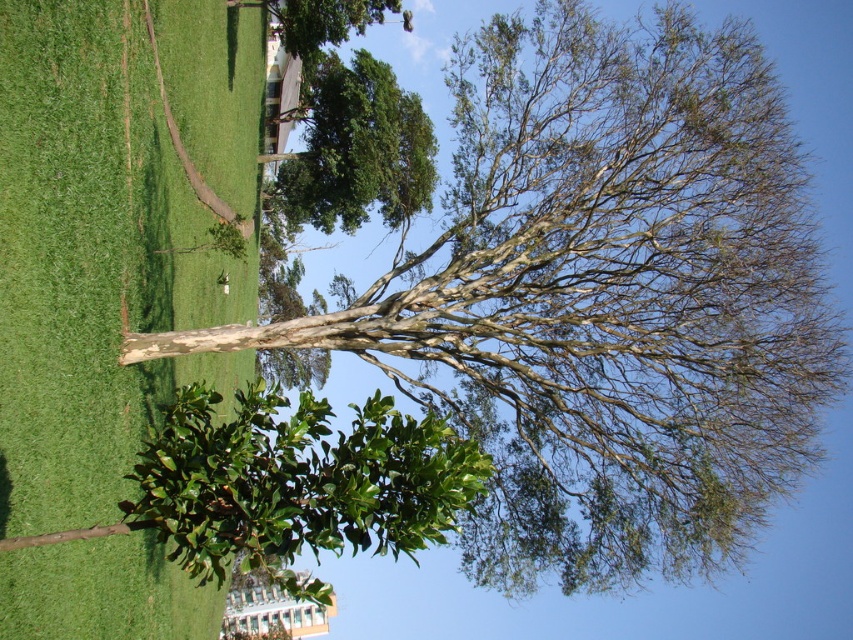
Between green grass at center and green leafy bush at lower left, which one is positioned higher?

green grass at center is higher up.

Who is positioned more to the left, green grass at center or green leafy bush at lower left?

green grass at center

Who is more forward, [117,632] or [231,476]?

Point [231,476] is in front.

This screenshot has height=640, width=853. Find the location of `green grass at center`. green grass at center is located at coordinates (x=114, y=230).

Which of these two, green grass at center or green leafy tree at upper center, stands shorter?

green leafy tree at upper center

Is green grass at center to the left of green leafy tree at upper center from the viewer's perspective?

Yes, green grass at center is to the left of green leafy tree at upper center.

Which is behind, point (190, 369) or point (340, 132)?

Point (340, 132)

I want to click on green grass at center, so click(114, 230).

Is point (260, 497) positioned in front of point (415, 129)?

Yes, point (260, 497) is in front of point (415, 129).

Between green leafy bush at lower left and green leafy tree at upper center, which one is positioned higher?

Positioned higher is green leafy tree at upper center.

Is point (372, 513) positioned before point (364, 120)?

Yes, point (372, 513) is closer to viewer.

You are a GUI agent. You are given a task and a screenshot of the screen. Output one action in this format:
    pyautogui.click(x=<x>, y=<y>)
    Task: Click on the green leafy bush at lower left
    This screenshot has height=640, width=853.
    Given the screenshot: What is the action you would take?
    pyautogui.click(x=297, y=483)